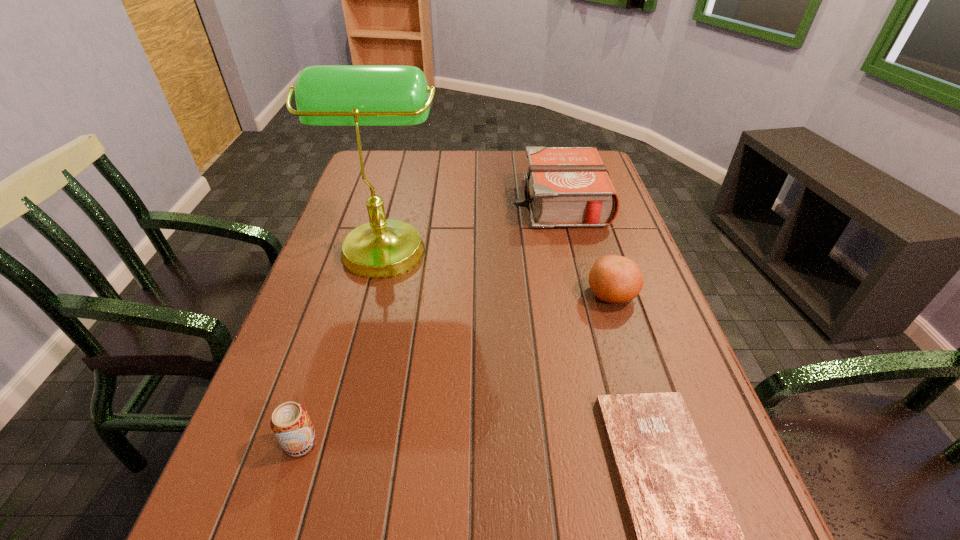
This screenshot has width=960, height=540. In order to click on the tallest object in this screenshot , I will do `click(326, 95)`.

Locate an element on the screen. the taller Bible is located at coordinates (565, 186).

Identify the location of the second tallest object. (565, 186).

Locate an element on the screen. clementine is located at coordinates (614, 279).

The image size is (960, 540). What are the coordinates of `beer can` in the screenshot? It's located at (291, 424).

You are a GUI agent. You are given a task and a screenshot of the screen. Output one action in this format:
    pyautogui.click(x=<x>, y=<y>)
    Task: Click on the vacant space situated on the desk next to the lamp
    
    Given the screenshot: What is the action you would take?
    pyautogui.click(x=523, y=245)

At what (x,y) coordinates should I click in order to perform the action: click on vacant space located 0.390m on the front of the taller Bible. Please return your answer as a coordinate pair (x, y). The width and height of the screenshot is (960, 540). Looking at the image, I should click on tap(592, 338).

Find the location of a particular element. vacant space positioned on the front of the clementine is located at coordinates (656, 433).

I want to click on vacant area located 0.090m on the right of the beer can, so click(371, 443).

Where is `object at the far edge`? This screenshot has height=540, width=960. object at the far edge is located at coordinates (565, 186).